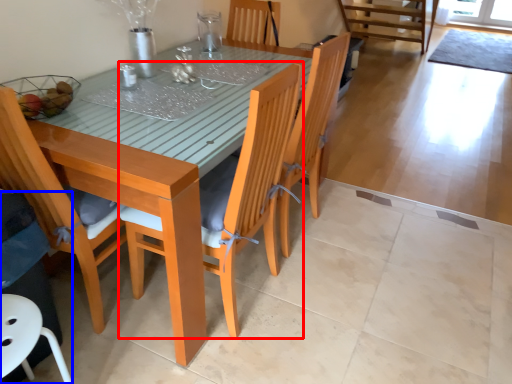
Question: Which object appears closest to the camera in this image, chair (highlighted by a red box) or swivel chair (highlighted by a blue box)?

Choices:
 (A) chair
 (B) swivel chair

Answer: (A)